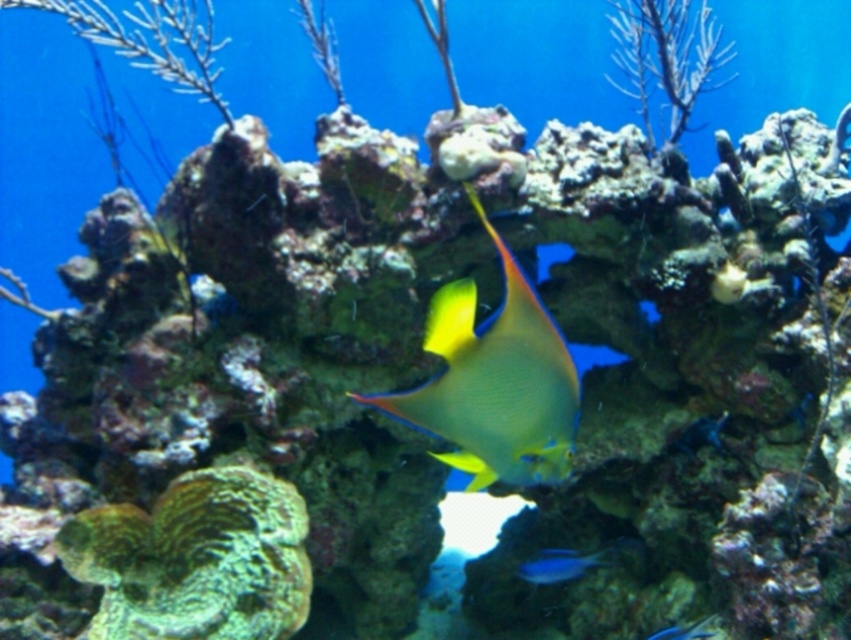
Question: Which point is closer to the camera taking this photo?

Choices:
 (A) (492, 228)
 (B) (666, 636)
 (C) (543, 560)

Answer: (A)

Question: Which of the following is the farthest from the observer?

Choices:
 (A) yellow matte fish at center
 (B) shiny blue fish at center

Answer: (B)

Question: Is yellow matte fish at center positioned at the back of shiny blue fish at center?

Choices:
 (A) no
 (B) yes

Answer: (A)

Question: Does yellow matte fish at center have a smaller size compared to blue glossy fish at center?

Choices:
 (A) yes
 (B) no

Answer: (B)

Question: Does yellow matte fish at center have a greater width compared to blue glossy fish at center?

Choices:
 (A) yes
 (B) no

Answer: (A)

Question: Which point is closer to the camera?

Choices:
 (A) (551, 580)
 (B) (473, 442)
 (C) (701, 620)

Answer: (B)